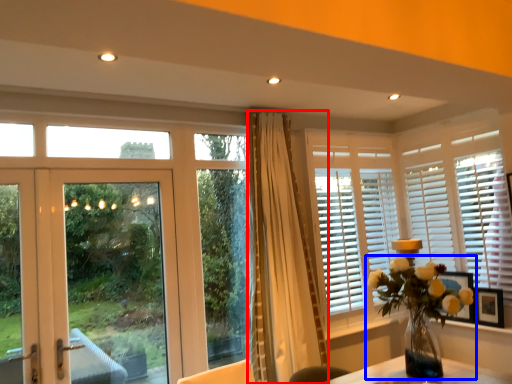
Question: Which object appears farthest to the camera in this image, curtain (highlighted by a red box) or houseplant (highlighted by a blue box)?

Choices:
 (A) curtain
 (B) houseplant

Answer: (A)